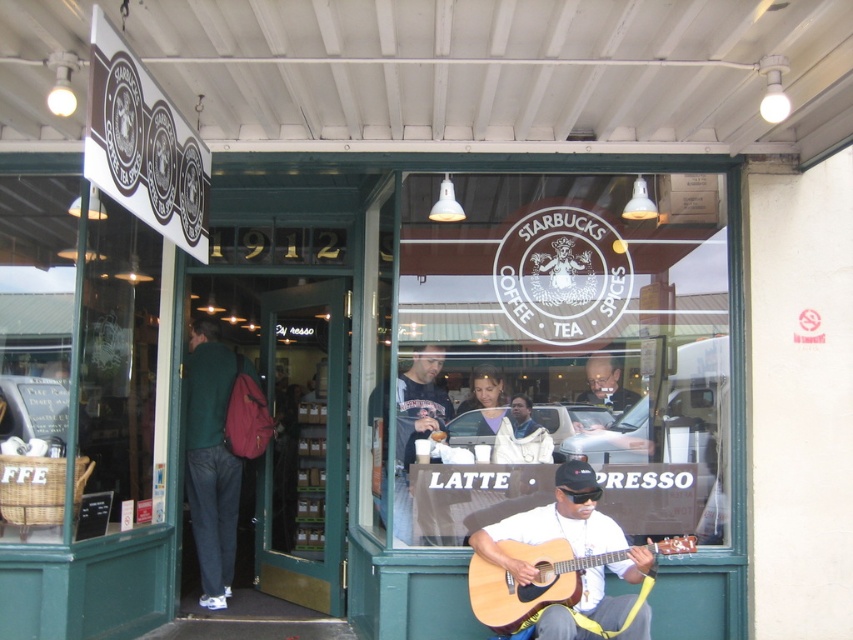
Does natural wood acoustic guitar at lower center have a greater height compared to matte black t-shirt at center?

Incorrect, natural wood acoustic guitar at lower center's height is not larger of matte black t-shirt at center's.

Which is behind, point (663, 541) or point (447, 410)?

The point (447, 410) is behind.

Identify the location of natural wood acoustic guitar at lower center. (531, 580).

Can you confirm if green matte jacket at left is shorter than matte black laptop at center?

Incorrect, green matte jacket at left's height does not fall short of matte black laptop at center's.

Is green matte jacket at left below matte black laptop at center?

Correct, green matte jacket at left is located below matte black laptop at center.

Is point (212, 545) in front of point (596, 396)?

No.

Where is `green matte jacket at left`? The height and width of the screenshot is (640, 853). green matte jacket at left is located at coordinates pyautogui.click(x=212, y=458).

Does matte black t-shirt at center appear on the right side of matte black laptop at center?

In fact, matte black t-shirt at center is to the left of matte black laptop at center.

Is point (419, 385) positioned behind point (601, 356)?

No, (419, 385) is closer to viewer.

Does point (383, 442) come in front of point (589, 390)?

No, (383, 442) is further to viewer.

Where is `matte black t-shirt at center`? This screenshot has width=853, height=640. matte black t-shirt at center is located at coordinates (415, 426).